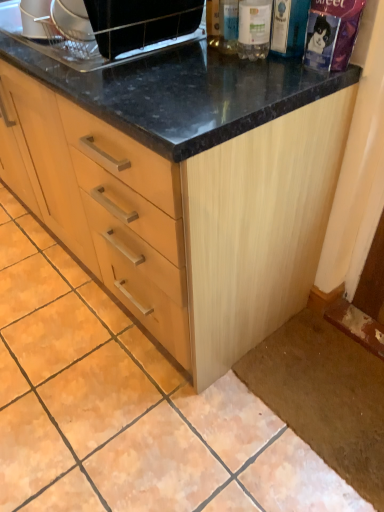
The width and height of the screenshot is (384, 512). What are the coordinates of `spots to the right of black glossy microwave at upper center` in the screenshot? It's located at (208, 60).